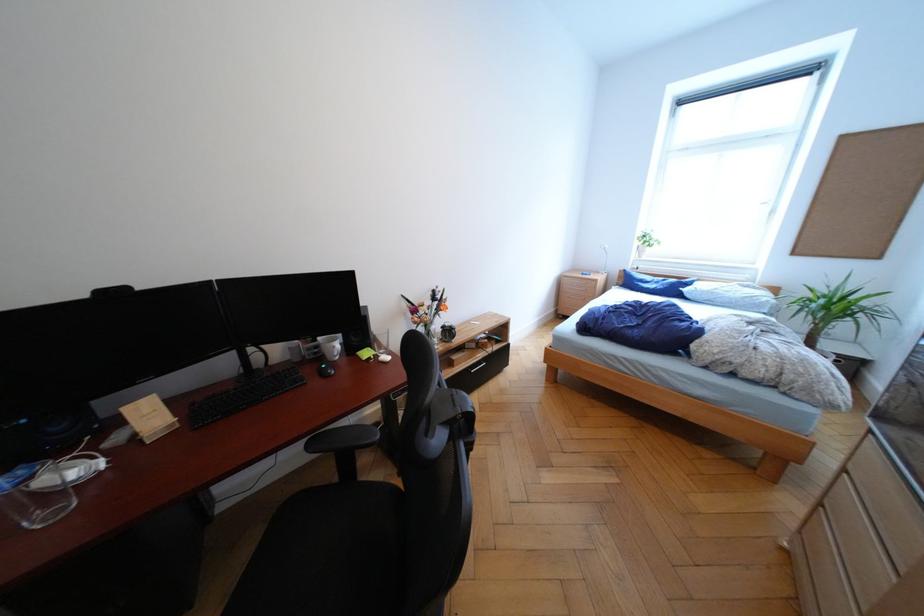
What do you see at coordinates (343, 439) in the screenshot? The height and width of the screenshot is (616, 924). I see `a black chair armrest` at bounding box center [343, 439].